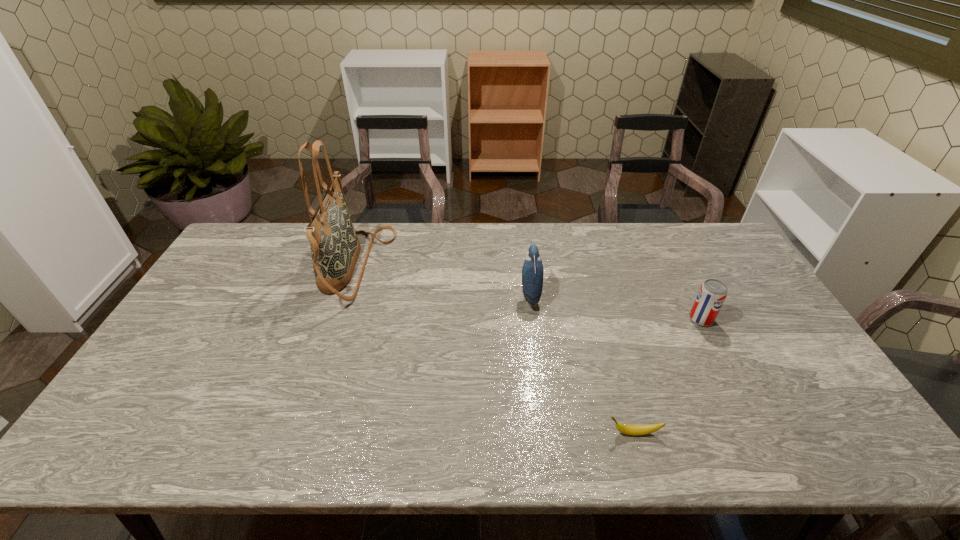
At what (x,y) coordinates should I click in order to perform the action: click on handbag. Please return your answer as a coordinate pair (x, y). Image resolution: width=960 pixels, height=540 pixels. Looking at the image, I should click on (335, 248).

The height and width of the screenshot is (540, 960). I want to click on the leftmost object, so click(x=335, y=248).

Where is `the second object from left to right`? The image size is (960, 540). the second object from left to right is located at coordinates (532, 270).

What are the coordinates of `the second tallest object` in the screenshot? It's located at (532, 270).

Find the location of a particular element. This screenshot has height=540, width=960. the rightmost object is located at coordinates (712, 294).

You are a GUI agent. You are given a task and a screenshot of the screen. Output one action in this format:
    pyautogui.click(x=<x>, y=<y>)
    Task: Click on the soda
    The width and height of the screenshot is (960, 540).
    Given the screenshot: What is the action you would take?
    pyautogui.click(x=712, y=294)

Find the location of a particular element. the second object from right to left is located at coordinates (636, 430).

The image size is (960, 540). Identify the location of the shortest object. (636, 430).

At what (x,y) coordinates should I click in order to perform the action: click on free space located on the front-facing side of the handbag. Please return your answer as a coordinate pair (x, y). The image size is (960, 540). Looking at the image, I should click on (448, 266).

Image resolution: width=960 pixels, height=540 pixels. I want to click on vacant space located at the tip of the second object from left to right's beak, so click(418, 295).